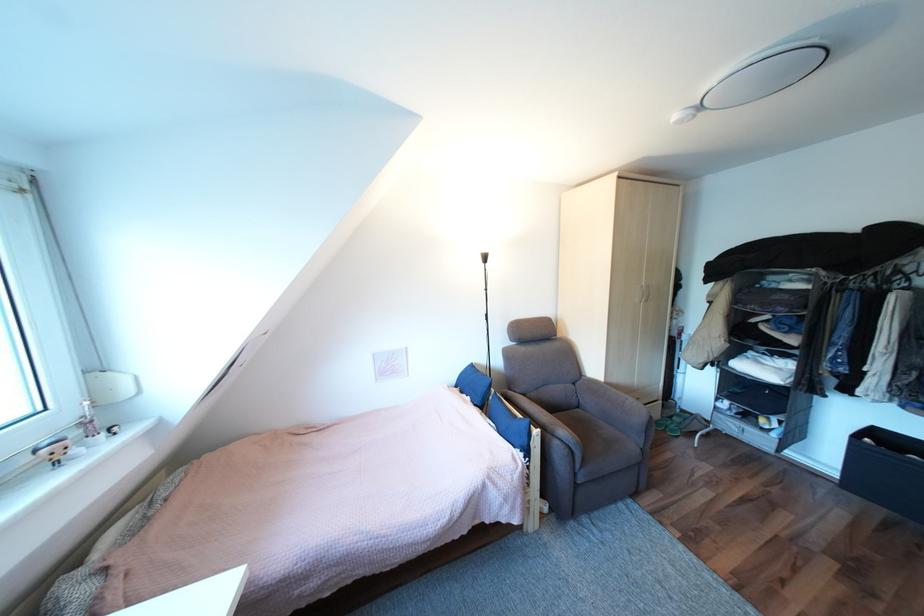
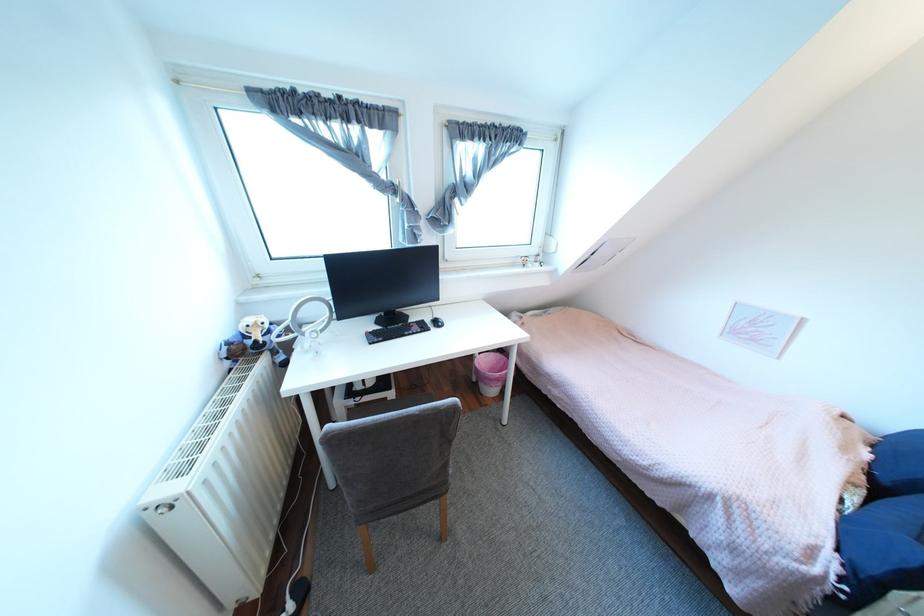
Find the pixel in the second image that matches pixel 538 453 in the first image.

(873, 586)